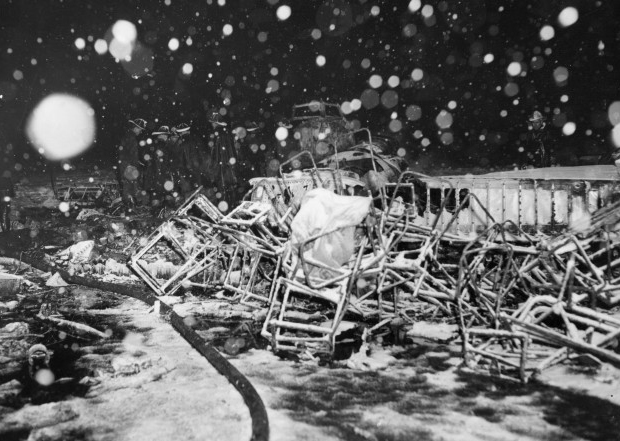
Locate an element on the screen. This screenshot has width=620, height=441. corner is located at coordinates (609, 432), (10, 428), (19, 41), (611, 12).